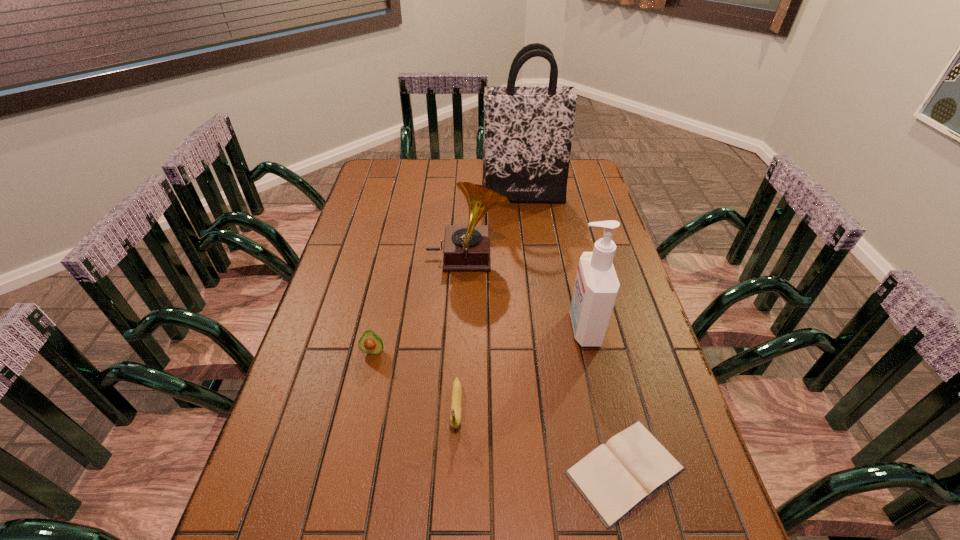
Locate an element on the screen. The width and height of the screenshot is (960, 540). free spot that satisfies the following two spatial constraints: 1. on the front label of the cleansing agent; 2. on the cut side of the avocado is located at coordinates (589, 351).

This screenshot has width=960, height=540. I want to click on vacant area in the image that satisfies the following two spatial constraints: 1. on the cut side of the shortest object; 2. on the right side of the leftmost object, so click(348, 470).

Locate an element on the screen. The image size is (960, 540). free location that satisfies the following two spatial constraints: 1. at the stem of the shortest object; 2. on the right side of the banana is located at coordinates (454, 470).

I want to click on vacant area that satisfies the following two spatial constraints: 1. on the front label of the cleansing agent; 2. at the stem of the banana, so click(x=602, y=407).

You are a GUI agent. You are given a task and a screenshot of the screen. Output one action in this format:
    pyautogui.click(x=<x>, y=<y>)
    Task: Click on the free region that satisfies the following two spatial constraints: 1. on the front label of the second tallest object; 2. on the left side of the shortest object
    The image size is (960, 540).
    Given the screenshot: What is the action you would take?
    pyautogui.click(x=616, y=470)

Identify the location of free space that satisfies the following two spatial constraints: 1. on the cut side of the shortest object; 2. on the right side of the avocado. (348, 470).